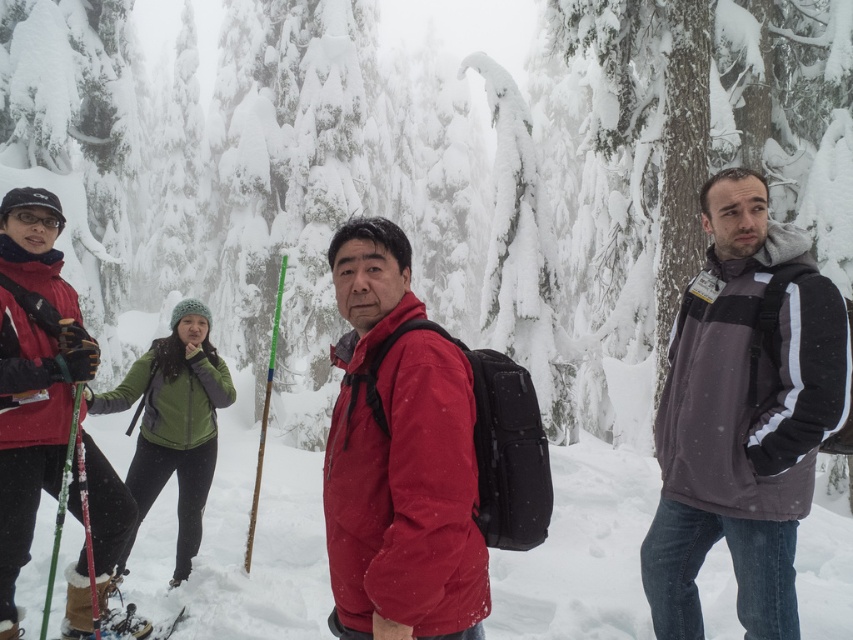
Question: Which point is farther to the camera?

Choices:
 (A) matte red jacket at center
 (B) matte red jacket at left
 (C) dark gray fleece jacket at center
 (D) matte black ski at lower left

Answer: (D)

Question: Observing the image, what is the correct spatial positioning of matte red jacket at left in reference to matte black ski at lower left?

Choices:
 (A) above
 (B) below

Answer: (A)

Question: Which object is farther from the camera taking this photo?

Choices:
 (A) green fleece jacket at center
 (B) matte red jacket at center
 (C) matte red jacket at left

Answer: (A)

Question: Is dark gray fleece jacket at center to the left of matte red jacket at center from the viewer's perspective?

Choices:
 (A) no
 (B) yes

Answer: (A)

Question: Which point is farther from the camera taking this photo?

Choices:
 (A) (125, 624)
 (B) (796, 266)

Answer: (A)

Question: Can you confirm if dark gray fleece jacket at center is smaller than green fleece jacket at center?

Choices:
 (A) no
 (B) yes

Answer: (B)